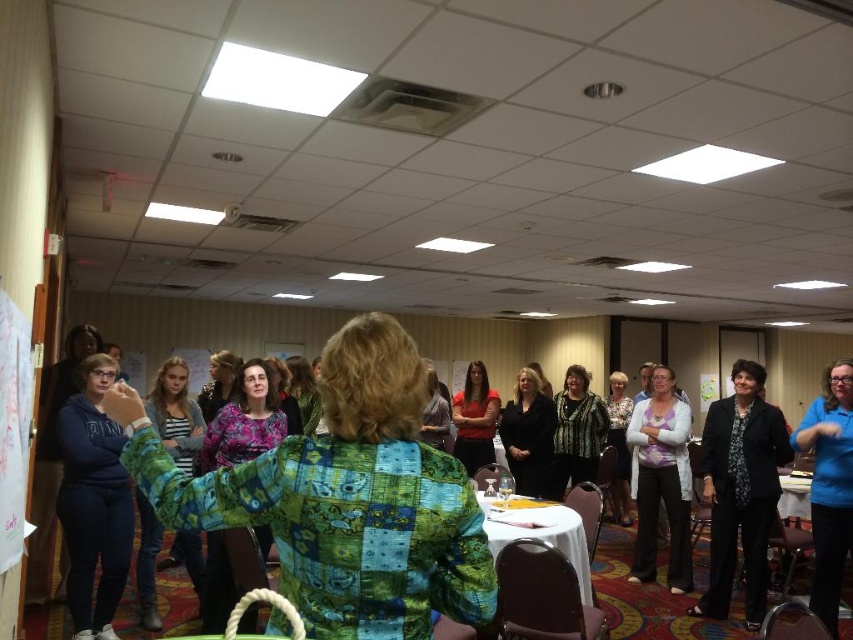
Who is shorter, white textured sweater at center or blue shirt at right?

blue shirt at right is shorter.

Which is in front, point (663, 376) or point (842, 508)?

Point (842, 508) is more forward.

Locate an element on the screen. The height and width of the screenshot is (640, 853). white textured sweater at center is located at coordinates (660, 481).

Does patterned fabric blouse at center have a lesser height compared to matte black shirt at center?

No.

Who is lower down, patterned fabric blouse at center or matte black shirt at center?

patterned fabric blouse at center

Is point (584, 474) farther from viewer compared to point (209, 408)?

Yes, point (584, 474) is behind point (209, 408).

Find the location of a particular element. patterned fabric blouse at center is located at coordinates (577, 432).

Does matte blue sweatshirt at left have a smaller size compared to floral blouse at center?

Yes.

Between matte blue sweatshirt at left and floral blouse at center, which one appears on the right side from the viewer's perspective?

floral blouse at center is more to the right.

Where is `matte blue sweatshirt at left`? The image size is (853, 640). matte blue sweatshirt at left is located at coordinates (93, 502).